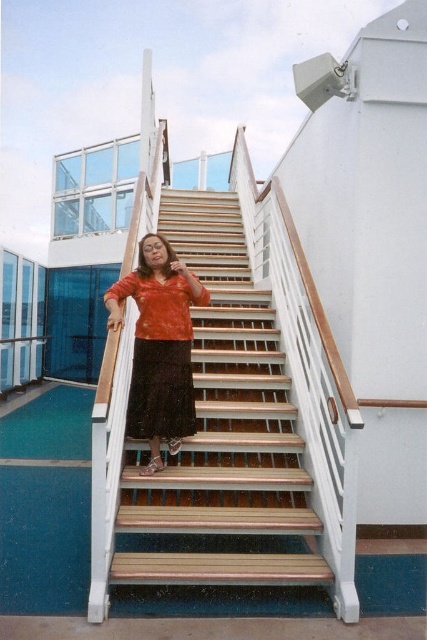
Does wooden stairs at center have a larger size compared to matte orange blouse at center?

Indeed, wooden stairs at center has a larger size compared to matte orange blouse at center.

Does wooden stairs at center appear on the right side of matte orange blouse at center?

Correct, you'll find wooden stairs at center to the right of matte orange blouse at center.

Image resolution: width=427 pixels, height=640 pixels. What do you see at coordinates (237, 440) in the screenshot?
I see `wooden stairs at center` at bounding box center [237, 440].

I want to click on wooden stairs at center, so click(x=237, y=440).